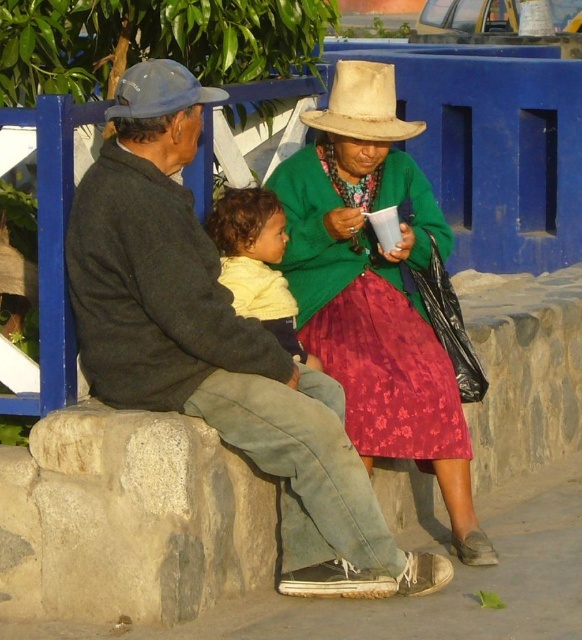
Between dark gray woolen sweater at center and matte blue cowboy hat at upper left, which one appears on the right side from the viewer's perspective?

Positioned to the right is dark gray woolen sweater at center.

In the scene shown: Can you confirm if dark gray woolen sweater at center is wider than matte blue cowboy hat at upper left?

Yes, dark gray woolen sweater at center is wider than matte blue cowboy hat at upper left.

Between point (318, 374) and point (168, 90), which one is positioned in front?

Point (168, 90)

The width and height of the screenshot is (582, 640). Identify the location of dark gray woolen sweater at center. (219, 362).

In the scene shown: Can you confirm if floral satin skirt at center is positioned to the left of natural straw cowboy hat at center?

Incorrect, floral satin skirt at center is not on the left side of natural straw cowboy hat at center.

The image size is (582, 640). What do you see at coordinates (388, 372) in the screenshot?
I see `floral satin skirt at center` at bounding box center [388, 372].

Which is in front, point (403, 326) or point (393, 83)?

Point (403, 326) is in front.

Find the location of a particular element. The image size is (582, 640). floral satin skirt at center is located at coordinates (388, 372).

Who is more distant from viewer, (x=353, y=323) or (x=236, y=294)?

The point (x=353, y=323) is behind.

Does floral satin skirt at center have a larger size compared to soft yellow sweater at center?

Correct, floral satin skirt at center is larger in size than soft yellow sweater at center.

Between point (386, 436) and point (275, 298), which one is positioned behind?

The point (386, 436) is more distant.

Locate an element on the screen. The image size is (582, 640). floral satin skirt at center is located at coordinates (388, 372).